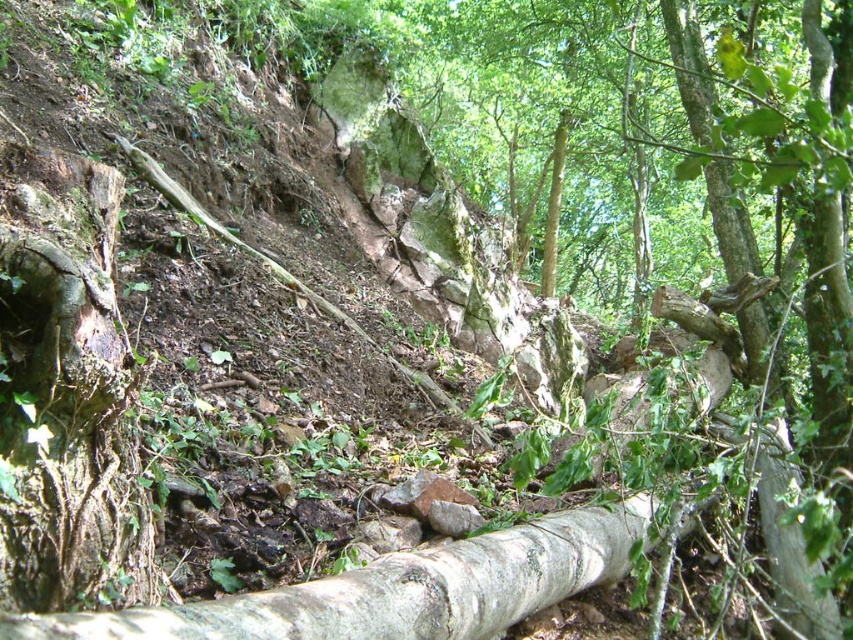
Question: Which point is closer to the camera taking this photo?

Choices:
 (A) (432, 609)
 (B) (9, 397)

Answer: (B)

Question: Is brown rough tree trunk at left smaller than white rough bark log at lower center?

Choices:
 (A) no
 (B) yes

Answer: (B)

Question: Is brown rough tree trunk at left wider than white rough bark log at lower center?

Choices:
 (A) no
 (B) yes

Answer: (A)

Question: Which point is farther to the camera?

Choices:
 (A) (59, 285)
 (B) (497, 579)

Answer: (B)

Question: Considering the relative positions of brown rough tree trunk at left and white rough bark log at lower center in the image provided, where is brown rough tree trunk at left located with respect to white rough bark log at lower center?

Choices:
 (A) below
 (B) above

Answer: (B)

Question: Which point is farther to the camera?

Choices:
 (A) click(x=561, y=596)
 (B) click(x=106, y=220)

Answer: (A)